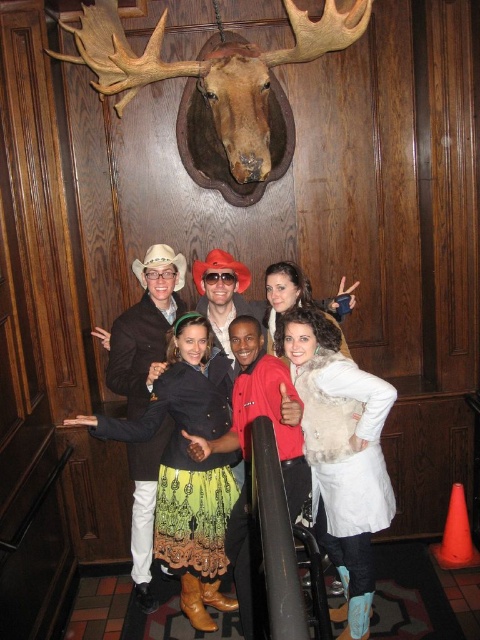
Who is higher up, brown polished wood reindeer head at upper center or green textured skirt at center?

brown polished wood reindeer head at upper center

Is brown polished wood reindeer head at upper center closer to the viewer compared to green textured skirt at center?

Yes, it is in front of green textured skirt at center.

Find the location of a particular element. The width and height of the screenshot is (480, 640). brown polished wood reindeer head at upper center is located at coordinates pyautogui.click(x=214, y=72).

This screenshot has height=640, width=480. I want to click on brown polished wood reindeer head at upper center, so click(x=214, y=72).

Consider the image. Which is above, multicolored woven skirt at center or green textured skirt at center?

green textured skirt at center

Describe the element at coordinates (348, 445) in the screenshot. The height and width of the screenshot is (640, 480). I see `multicolored woven skirt at center` at that location.

Where is `multicolored woven skirt at center`? multicolored woven skirt at center is located at coordinates (348, 445).

Who is higher up, multicolored woven skirt at center or brown polished wood reindeer head at upper center?

brown polished wood reindeer head at upper center

Describe the element at coordinates (348, 445) in the screenshot. This screenshot has height=640, width=480. I see `multicolored woven skirt at center` at that location.

At what (x,y) coordinates should I click in order to perform the action: click on multicolored woven skirt at center. Please return your answer as a coordinate pair (x, y). Image resolution: width=480 pixels, height=640 pixels. Looking at the image, I should click on (348, 445).